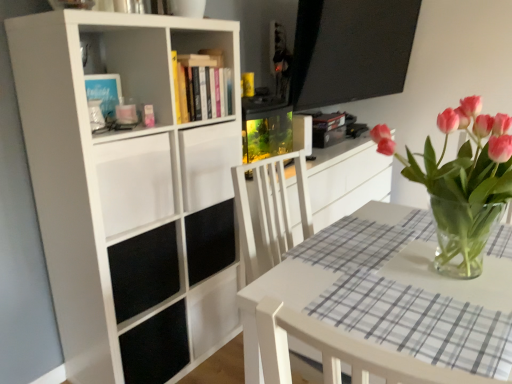
Identify the location of white matte drawer at upper left. The height and width of the screenshot is (384, 512). (134, 182).

Consider the image. Measure the distance between point (x=206, y=102) and camera.

The depth of point (x=206, y=102) is 5.62 feet.

Locate an element on the screen. The height and width of the screenshot is (384, 512). hardcover books at upper center is located at coordinates (202, 86).

What do you see at coordinates (379, 307) in the screenshot?
I see `white glossy table at center` at bounding box center [379, 307].

The height and width of the screenshot is (384, 512). Find the location of `white matte drawer at upper left`. white matte drawer at upper left is located at coordinates (134, 182).

From the image's perspective, does white matte bookcase at left appear higher than white wood chair at lower right?

Yes, from the image's perspective, white matte bookcase at left is over white wood chair at lower right.

Is white matte bookcase at left next to white wood chair at lower right and touching it?

No, white matte bookcase at left is not beside white wood chair at lower right.

Is white matte bookcase at left turned away from white wood chair at lower right?

No.

Is white matte bookcase at left inside the boundaries of white wood chair at lower right, or outside?

white matte bookcase at left is not enclosed by white wood chair at lower right.

Considering the relative positions of pink glass vase at center and white matte drawer at upper left in the image provided, is pink glass vase at center to the left of white matte drawer at upper left from the viewer's perspective?

Incorrect, pink glass vase at center is not on the left side of white matte drawer at upper left.

Considering the positions of point (461, 232) and point (136, 149), is point (461, 232) closer or farther from the camera than point (136, 149)?

Point (461, 232) is closer to the camera than point (136, 149).

Is pink glass vase at center bigger than white matte drawer at upper left?

Indeed, pink glass vase at center has a larger size compared to white matte drawer at upper left.

How far apart are pink glass vase at center and white matte drawer at upper left?

They are 89.68 centimeters apart.

This screenshot has width=512, height=384. Identify the location of houseplant that appears on the right of white wood chair at lower right. (462, 183).

In terms of height, does pink glass vase at center look taller or shorter compared to white wood chair at lower right?

Clearly, pink glass vase at center is taller compared to white wood chair at lower right.

Is pink glass vase at center situated inside white wood chair at lower right or outside?

The correct answer is: outside.

Does pink glass vase at center turn towards white wood chair at lower right?

No, pink glass vase at center is not facing towards white wood chair at lower right.

Which is behind, point (80, 344) or point (260, 377)?

The point (80, 344) is farther from the camera.

Considering their positions, is white matte bookcase at left located in front of or behind white glossy table at center?

white matte bookcase at left is behind white glossy table at center.

Could you tell me if white matte bookcase at left is facing white glossy table at center?

Yes, white matte bookcase at left faces towards white glossy table at center.

Does white matte bookcase at left have a greater width compared to white glossy table at center?

No.

In the scene shown: From the image's perspective, would you say white matte drawer at upper left is positioned over white wood chair at lower right?

Correct, white matte drawer at upper left appears higher than white wood chair at lower right in the image.

Between white matte drawer at upper left and white wood chair at lower right, which one appears on the left side from the viewer's perspective?

white matte drawer at upper left is more to the left.

In the scene shown: Considering the positions of objects white matte drawer at upper left and white wood chair at lower right in the image provided, who is in front, white matte drawer at upper left or white wood chair at lower right?

white wood chair at lower right is closer to the camera.

The height and width of the screenshot is (384, 512). What are the coordinates of `drawer on the left side of white wood chair at lower right` in the screenshot? It's located at (134, 182).

Measure the distance between hardcover books at upper center and white glossy table at center.

Answer: 83.68 centimeters.

Looking at their sizes, would you say hardcover books at upper center is wider or thinner than white glossy table at center?

Clearly, hardcover books at upper center has less width compared to white glossy table at center.

The image size is (512, 384). Identify the location of table lying in front of the hardcover books at upper center. (379, 307).

Is hardcover books at upper center smaller than white glossy table at center?

Yes.

In the scene shown: Which object is wider, pink glass vase at center or white glossy table at center?

With larger width is white glossy table at center.

From a real-world perspective, is pink glass vase at center on top of white glossy table at center?

Correct, in the physical world, pink glass vase at center is higher than white glossy table at center.

Would you say pink glass vase at center is outside white glossy table at center?

Indeed, pink glass vase at center is completely outside white glossy table at center.

Is pink glass vase at center smaller than white glossy table at center?

Indeed, pink glass vase at center has a smaller size compared to white glossy table at center.

Find the location of a particular element. The height and width of the screenshot is (384, 512). chair positioned vertically above the white matte bookcase at left (from a real-world perspective) is located at coordinates (340, 352).

The height and width of the screenshot is (384, 512). I want to click on houseplant that is in front of the white matte drawer at upper left, so click(462, 183).

When comparing their distances from white matte bookcase at left, does pink glass vase at center or white matte drawer at upper left seem closer?

Based on the image, white matte drawer at upper left appears to be nearer to white matte bookcase at left.

From the image, which object appears to be farther from hardcover books at upper center, pink glass vase at center or white glossy table at center?

pink glass vase at center.

From the image, which object appears to be nearer to white wood chair at lower right, hardcover books at upper center or pink glass vase at center?

pink glass vase at center is positioned closer to the anchor white wood chair at lower right.

Which object lies further to the anchor point white glossy table at center, white wood chair at lower right or white matte bookcase at left?

white matte bookcase at left lies further to white glossy table at center than the other object.

Looking at the image, which one is located closer to white matte drawer at upper left, white matte bookcase at left or white wood chair at lower right?

white matte bookcase at left.

Looking at the image, which one is located closer to pink glass vase at center, white wood chair at lower right or white matte bookcase at left?

white wood chair at lower right is closer to pink glass vase at center.

From the image, which object appears to be nearer to white glossy table at center, hardcover books at upper center or pink glass vase at center?

pink glass vase at center is closer to white glossy table at center.

From the image, which object appears to be farther from white matte bookcase at left, hardcover books at upper center or white wood chair at lower right?

The object further to white matte bookcase at left is white wood chair at lower right.

The height and width of the screenshot is (384, 512). Find the location of `chair between white matte drawer at upper left and white glossy table at center`. chair between white matte drawer at upper left and white glossy table at center is located at coordinates (340, 352).

Image resolution: width=512 pixels, height=384 pixels. In order to click on book between white matte drawer at upper left and white glossy table at center from left to right in this screenshot , I will do `click(202, 86)`.

Locate an element on the screen. This screenshot has width=512, height=384. bookcase located between white matte drawer at upper left and white wood chair at lower right in the left-right direction is located at coordinates (130, 192).

You are a GUI agent. You are given a task and a screenshot of the screen. Output one action in this format:
    pyautogui.click(x=<x>, y=<y>)
    Task: Click on the chair that lies between pink glass vase at center and white glossy table at center from top to bottom
    The width and height of the screenshot is (512, 384).
    Given the screenshot: What is the action you would take?
    pyautogui.click(x=340, y=352)